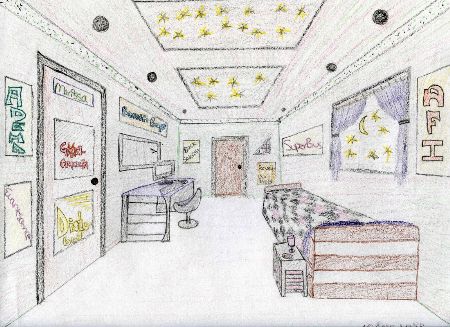
Where is `bed`? The width and height of the screenshot is (450, 327). bed is located at coordinates (307, 215).